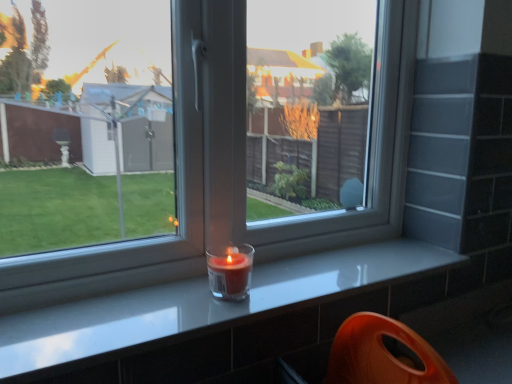
Question: In the image, is translucent glass candle at window positioned in front of or behind smooth gray counter at center?

Choices:
 (A) front
 (B) behind

Answer: (B)

Question: From a real-world perspective, is translucent glass candle at window above or below smooth gray counter at center?

Choices:
 (A) above
 (B) below

Answer: (A)

Question: In terms of width, does translucent glass candle at window look wider or thinner when compared to smooth gray counter at center?

Choices:
 (A) thin
 (B) wide

Answer: (A)

Question: From the image's perspective, is smooth gray counter at center located above or below translucent glass candle at window?

Choices:
 (A) above
 (B) below

Answer: (B)

Question: Is smooth gray counter at center inside or outside of translucent glass candle at window?

Choices:
 (A) outside
 (B) inside

Answer: (A)

Question: From a real-world perspective, is smooth gray counter at center positioned above or below translucent glass candle at window?

Choices:
 (A) below
 (B) above

Answer: (A)

Question: Considering their positions, is smooth gray counter at center located in front of or behind translucent glass candle at window?

Choices:
 (A) front
 (B) behind

Answer: (A)